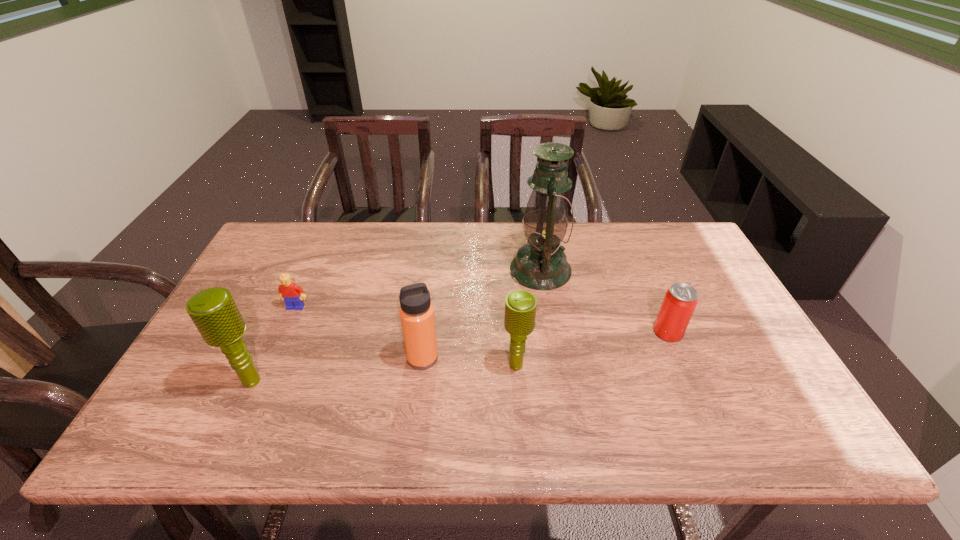
What are the coordinates of `free space between the taller microphone and the can` in the screenshot? It's located at (460, 356).

You are a GUI agent. You are given a task and a screenshot of the screen. Output one action in this format:
    pyautogui.click(x=<x>, y=<y>)
    Task: Click on the empty space between the farthest object and the thermos bottle
    The width and height of the screenshot is (960, 540).
    Given the screenshot: What is the action you would take?
    pyautogui.click(x=481, y=314)

Locate an element on the screen. free space that is in between the farthest object and the left microphone is located at coordinates (396, 325).

At what (x,y) coordinates should I click in order to perform the action: click on free space that is in between the farthest object and the left microphone. Please return your answer as a coordinate pair (x, y). The width and height of the screenshot is (960, 540). Looking at the image, I should click on (396, 325).

Locate an element on the screen. This screenshot has height=540, width=960. the second closest object to the farthest object is located at coordinates (520, 306).

Image resolution: width=960 pixels, height=540 pixels. I want to click on object that can be found as the fifth closest to the thermos bottle, so click(x=680, y=300).

This screenshot has height=540, width=960. Identify the location of free space that satisfies the following two spatial constraints: 1. on the face of the fifth nearest object; 2. on the right side of the can. (285, 332).

Image resolution: width=960 pixels, height=540 pixels. Find the location of `vacant space that satisfies the following two spatial constraints: 1. on the face of the fourth object from right to left; 2. on the left side of the Lego`. vacant space that satisfies the following two spatial constraints: 1. on the face of the fourth object from right to left; 2. on the left side of the Lego is located at coordinates (274, 358).